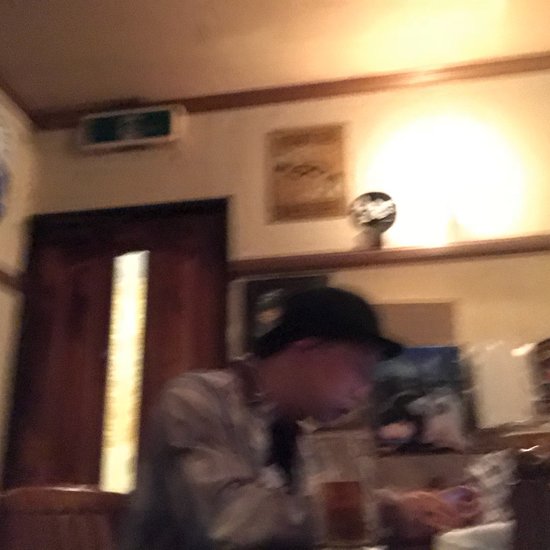
The width and height of the screenshot is (550, 550). In order to click on light in this screenshot , I will do `click(385, 210)`.